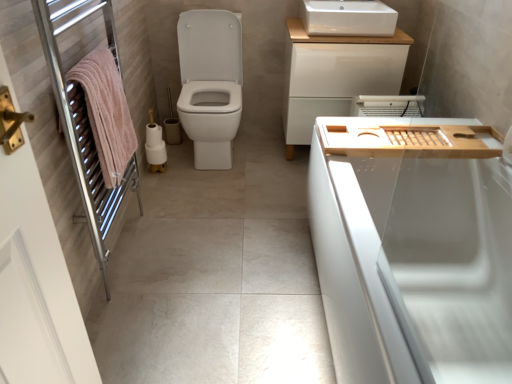
Question: Is white ceramic sink at upper center a part of wooden tray at right?

Choices:
 (A) yes
 (B) no

Answer: (B)

Question: Is wooden tray at right outside of white ceramic sink at upper center?

Choices:
 (A) yes
 (B) no

Answer: (A)

Question: Is wooden tray at right further to camera compared to white ceramic sink at upper center?

Choices:
 (A) yes
 (B) no

Answer: (B)

Question: Are wooden tray at right and white ceramic sink at upper center making contact?

Choices:
 (A) yes
 (B) no

Answer: (B)

Question: Is wooden tray at right to the right of white ceramic sink at upper center from the viewer's perspective?

Choices:
 (A) no
 (B) yes

Answer: (B)

Question: Does wooden tray at right have a greater width compared to white ceramic sink at upper center?

Choices:
 (A) no
 (B) yes

Answer: (A)

Question: Does pink soft towel at left appear on the right side of white matte toilet paper at center?

Choices:
 (A) no
 (B) yes

Answer: (B)

Question: Can you confirm if pink soft towel at left is bigger than white matte toilet paper at center?

Choices:
 (A) no
 (B) yes

Answer: (B)

Question: Considering the relative sizes of pink soft towel at left and white matte toilet paper at center in the image provided, is pink soft towel at left smaller than white matte toilet paper at center?

Choices:
 (A) yes
 (B) no

Answer: (B)

Question: Is there a large distance between pink soft towel at left and white matte toilet paper at center?

Choices:
 (A) yes
 (B) no

Answer: (B)

Question: From the image's perspective, would you say pink soft towel at left is positioned over white matte toilet paper at center?

Choices:
 (A) no
 (B) yes

Answer: (A)

Question: Considering the relative sizes of pink soft towel at left and white matte toilet paper at center in the image provided, is pink soft towel at left wider than white matte toilet paper at center?

Choices:
 (A) no
 (B) yes

Answer: (B)

Question: Does pink soft towel at left lie in front of wooden tray at right?

Choices:
 (A) no
 (B) yes

Answer: (B)